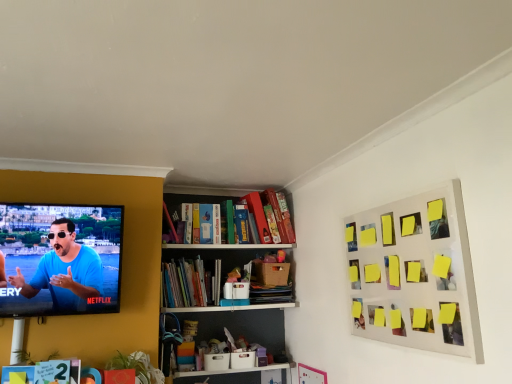
Question: From a real-world perspective, does yellow sticky notes at upper right stand above hardcover books at center, which is the first book from right to left?

Choices:
 (A) no
 (B) yes

Answer: (B)

Question: Is yellow sticky notes at upper right positioned in front of hardcover books at center, which is the first book from right to left?

Choices:
 (A) yes
 (B) no

Answer: (A)

Question: Considering the relative sizes of yellow sticky notes at upper right and hardcover books at center, the 1th book in the top-to-bottom sequence, in the image provided, is yellow sticky notes at upper right thinner than hardcover books at center, the 1th book in the top-to-bottom sequence,?

Choices:
 (A) no
 (B) yes

Answer: (B)

Question: Considering the relative sizes of yellow sticky notes at upper right and hardcover books at center, positioned as the 2th book in bottom-to-top order, in the image provided, is yellow sticky notes at upper right wider than hardcover books at center, positioned as the 2th book in bottom-to-top order,?

Choices:
 (A) no
 (B) yes

Answer: (A)

Question: Considering the relative sizes of yellow sticky notes at upper right and hardcover books at center, which is the first book from right to left, in the image provided, is yellow sticky notes at upper right taller than hardcover books at center, which is the first book from right to left,?

Choices:
 (A) yes
 (B) no

Answer: (A)

Question: Are yellow sticky notes at upper right and hardcover books at center, the second book in the left-to-right sequence, making contact?

Choices:
 (A) no
 (B) yes

Answer: (A)

Question: Does yellow sticky notes at upper right lie behind hardcover book at lower left, marked as the second book in a back-to-front arrangement?

Choices:
 (A) no
 (B) yes

Answer: (A)

Question: Is yellow sticky notes at upper right looking in the opposite direction of hardcover book at lower left, which is the first book in bottom-to-top order?

Choices:
 (A) no
 (B) yes

Answer: (A)

Question: Is yellow sticky notes at upper right wider than hardcover book at lower left, which ranks as the 2th book in right-to-left order?

Choices:
 (A) yes
 (B) no

Answer: (B)

Question: From the image's perspective, is yellow sticky notes at upper right located above hardcover book at lower left, which is the first book in bottom-to-top order?

Choices:
 (A) yes
 (B) no

Answer: (A)

Question: From a real-world perspective, is yellow sticky notes at upper right physically above hardcover book at lower left, the first book in the front-to-back sequence?

Choices:
 (A) no
 (B) yes

Answer: (B)

Question: Considering the relative positions of yellow sticky notes at upper right and hardcover book at lower left, the first book in the front-to-back sequence, in the image provided, is yellow sticky notes at upper right to the left of hardcover book at lower left, the first book in the front-to-back sequence, from the viewer's perspective?

Choices:
 (A) yes
 (B) no

Answer: (B)

Question: From the image's perspective, is hardcover book at lower left, marked as the second book in a back-to-front arrangement, above matte blue shirt at left?

Choices:
 (A) yes
 (B) no

Answer: (B)